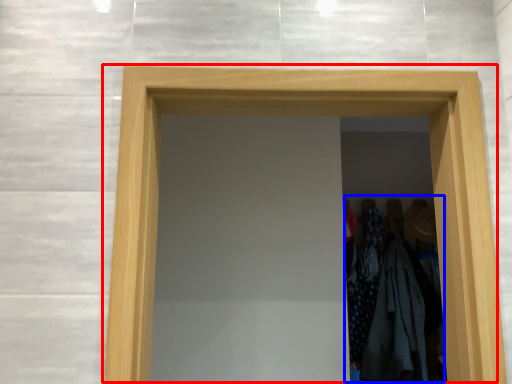
Question: Which of the following is the farthest to the observer, door (highlighted by a red box) or laundry (highlighted by a blue box)?

Choices:
 (A) door
 (B) laundry

Answer: (B)